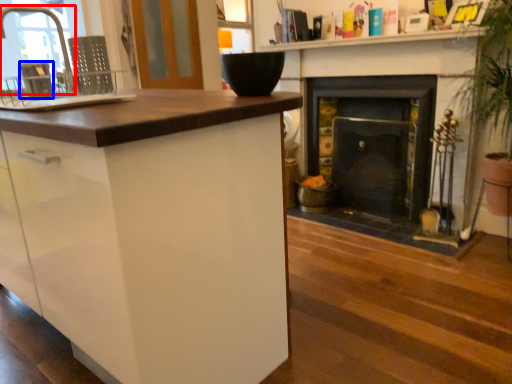
Question: Among these objects, which one is farthest to the camera, faucet (highlighted by a red box) or appliance (highlighted by a blue box)?

Choices:
 (A) faucet
 (B) appliance

Answer: (A)